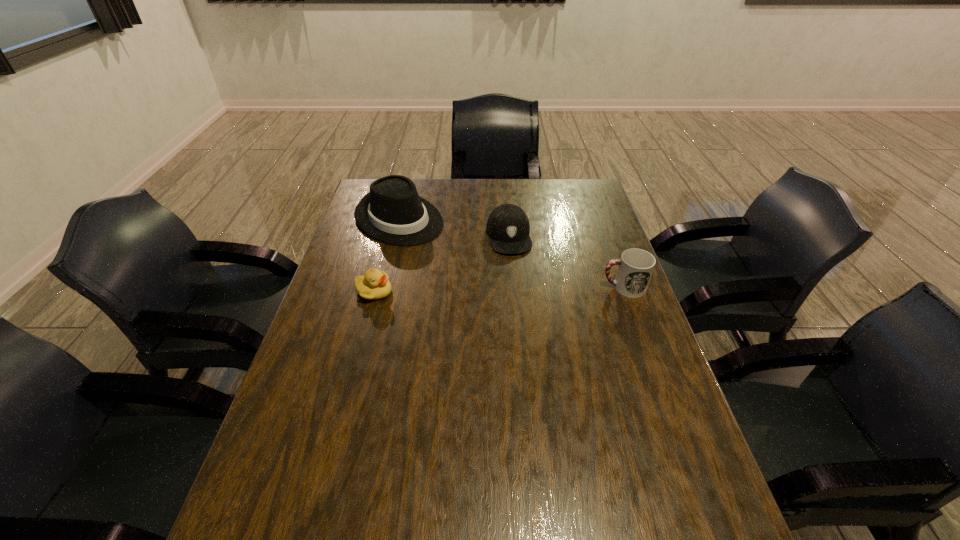
Image resolution: width=960 pixels, height=540 pixels. In order to click on vacant space at the near edge of the desktop in this screenshot , I will do `click(490, 495)`.

You are a GUI agent. You are given a task and a screenshot of the screen. Output one action in this format:
    pyautogui.click(x=<x>, y=<y>)
    Task: Click on the vacant space at the left edge of the desktop
    This screenshot has height=540, width=960.
    Given the screenshot: What is the action you would take?
    pyautogui.click(x=272, y=438)

Locate an element on the screen. free spot at the right edge of the desktop is located at coordinates (591, 316).

This screenshot has width=960, height=540. Identify the location of vacant space at the far left corner of the desktop. (363, 194).

Locate an element on the screen. vacant space that's between the rightmost object and the duckling is located at coordinates (498, 289).

Find the location of a particular element. This screenshot has width=960, height=540. empty location between the duckling and the cup is located at coordinates (498, 289).

Where is `vacant space that is in between the fedora and the cap`? Image resolution: width=960 pixels, height=540 pixels. vacant space that is in between the fedora and the cap is located at coordinates (454, 227).

This screenshot has height=540, width=960. What are the coordinates of `unoccupied position between the duckling and the cup` in the screenshot? It's located at click(x=498, y=289).

The width and height of the screenshot is (960, 540). I want to click on vacant area that lies between the fedora and the cap, so click(454, 227).

Locate an element on the screen. free spot between the cup and the third object from left to right is located at coordinates (566, 262).